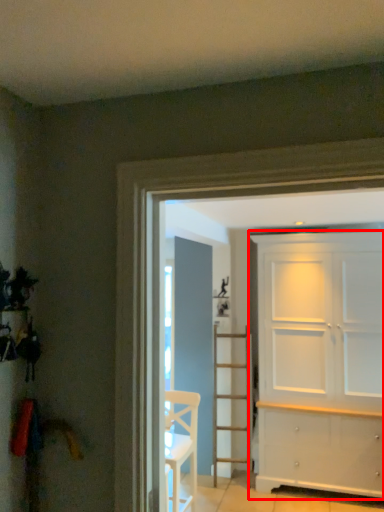
Question: Where is door (annotated by the red box) located in relation to chair in the image?

Choices:
 (A) left
 (B) right

Answer: (B)